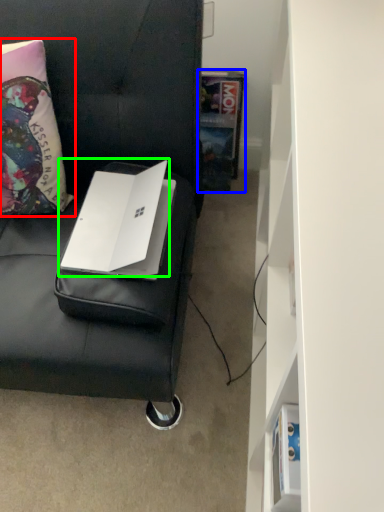
Question: Based on their relative distances, which object is nearer to pillow (highlighted by a red box)? Choose from book (highlighted by a blue box) and laptop (highlighted by a green box).

Choices:
 (A) book
 (B) laptop

Answer: (B)